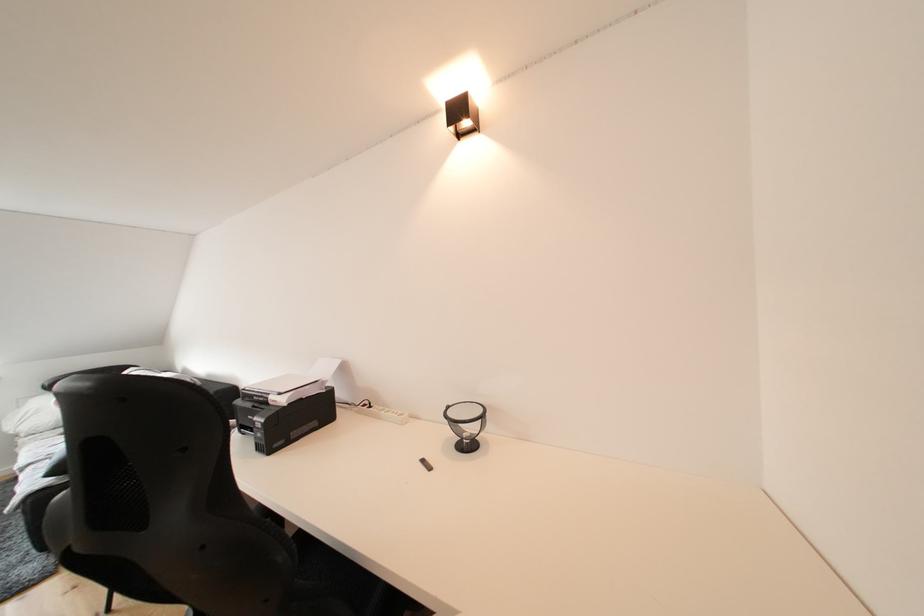
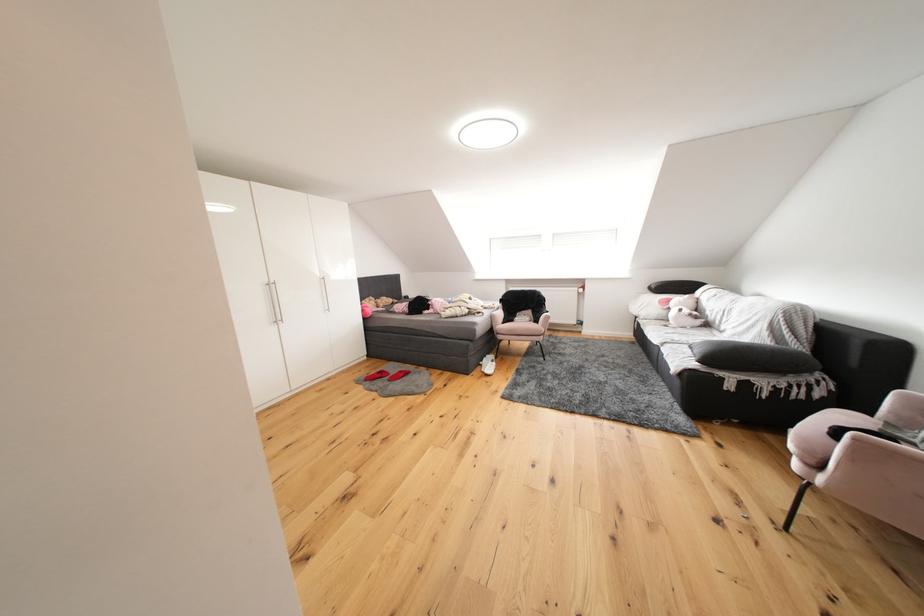
Question: The images are taken continuously from a first-person perspective. In which direction is your viewpoint rotating?

Choices:
 (A) Left
 (B) Right
 (C) Up
 (D) Down

Answer: (A)